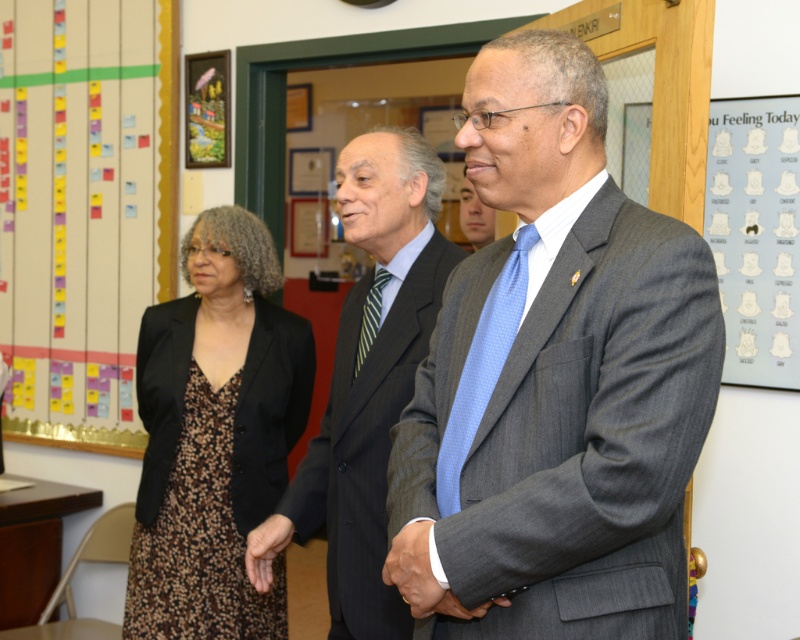
You are a photographer standing in the middle of the room. You want to take a picture of both the leopard print dress at left and the dark gray suit at center without moving either subject. Is there enough space between them for you to capture both in a single frame?

The leopard print dress at left and dark gray suit at center are 27.14 inches apart. Since the distance between them is sufficient for a camera to capture both subjects in one frame without needing to adjust their positions, yes, you can take the photo as desired.

You are standing in the classroom and want to hand a document to the person wearing the gray suit at center and the person with the green striped tie at center. Which one can you reach first without moving closer?

You can reach the gray suit at center first because it is closer to you than the green striped tie at center.